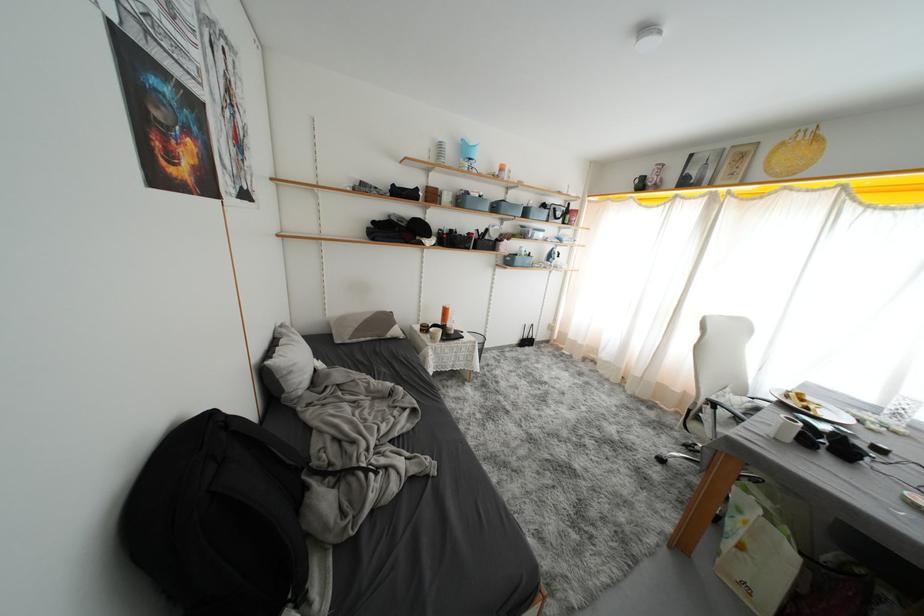
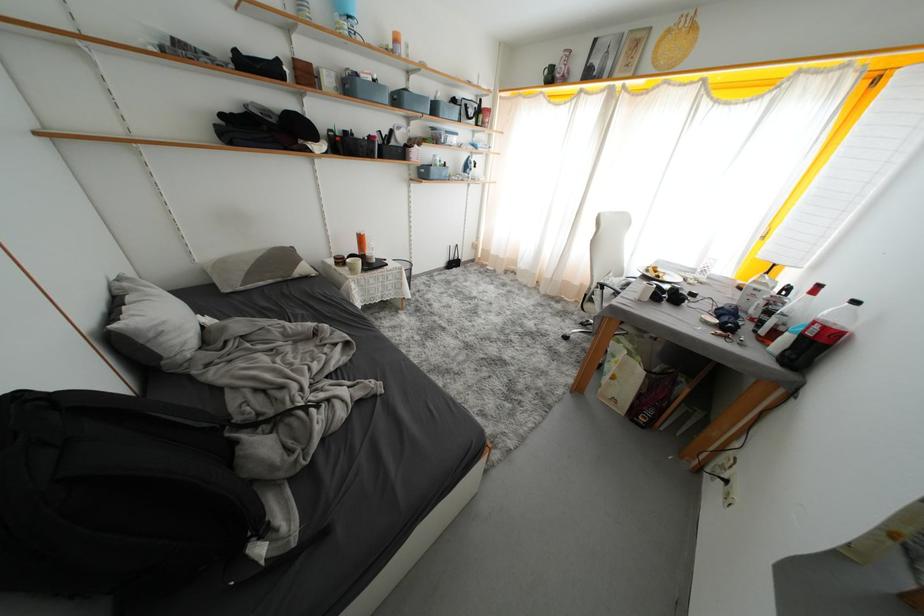
In the second image, find the point that corresponds to (x=813, y=411) in the first image.

(664, 281)